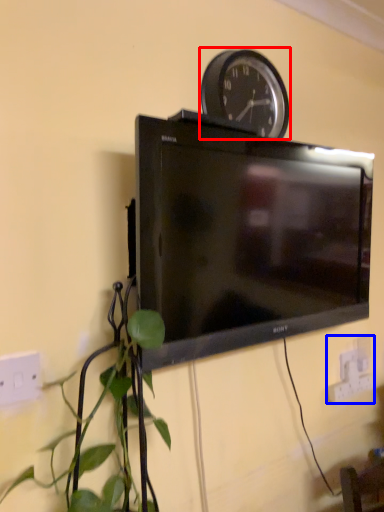
Question: Among these objects, which one is nearest to the camera, wall clock (highlighted by a red box) or electric outlet (highlighted by a blue box)?

Choices:
 (A) wall clock
 (B) electric outlet

Answer: (A)